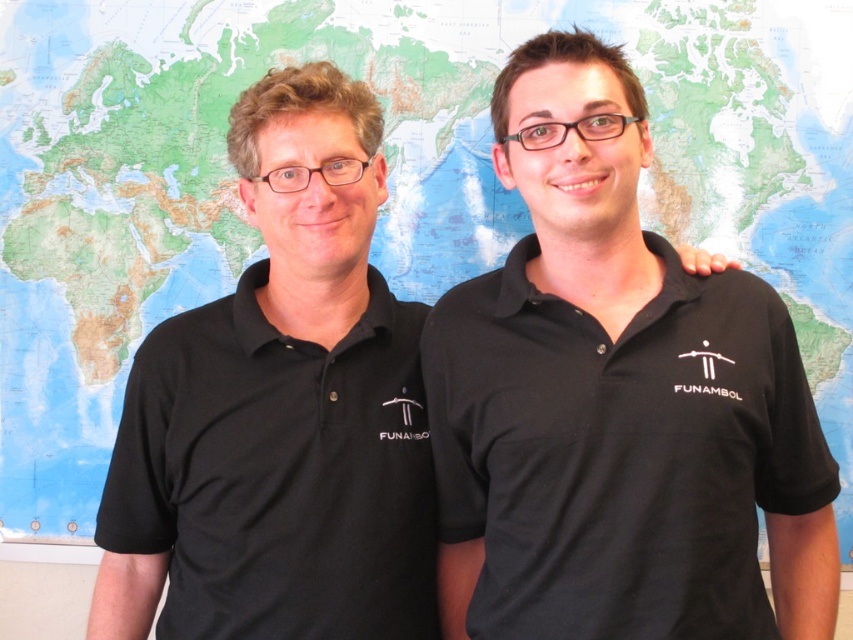
Question: Is the position of black matte shirt at right less distant than that of black matte shirt at left?

Choices:
 (A) no
 (B) yes

Answer: (B)

Question: Which point is farther from the camera taking this photo?

Choices:
 (A) (259, 260)
 (B) (751, 477)

Answer: (A)

Question: Can you confirm if black matte shirt at right is smaller than black matte shirt at left?

Choices:
 (A) yes
 (B) no

Answer: (B)

Question: Which point is farther from the camera taking this photo?

Choices:
 (A) (350, 579)
 (B) (755, 310)

Answer: (B)

Question: Does black matte shirt at right appear on the right side of black matte shirt at left?

Choices:
 (A) no
 (B) yes

Answer: (B)

Question: Which of the following is the closest to the observer?

Choices:
 (A) (672, 593)
 (B) (384, 472)

Answer: (A)